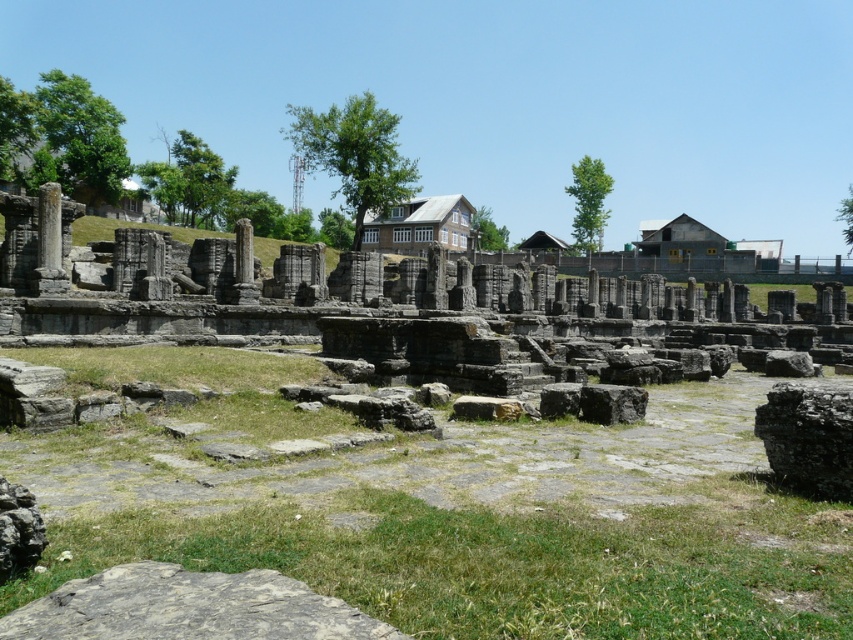
Does gray rough stone at lower right appear under rusty metallic rock at lower left?

No, gray rough stone at lower right is not below rusty metallic rock at lower left.

Can you confirm if gray rough stone at lower right is thinner than rusty metallic rock at lower left?

No, gray rough stone at lower right is not thinner than rusty metallic rock at lower left.

Between point (759, 410) and point (3, 579), which one is positioned in front?

Point (3, 579)

At what (x,y) coordinates should I click in order to perform the action: click on gray rough stone at lower right. Please return your answer as a coordinate pair (x, y). Looking at the image, I should click on (808, 436).

What do you see at coordinates (508, 563) in the screenshot? I see `green grass at lower center` at bounding box center [508, 563].

Which is in front, point (280, 528) or point (366, 621)?

Positioned in front is point (366, 621).

Locate an element on the screen. The width and height of the screenshot is (853, 640). green grass at lower center is located at coordinates (508, 563).

Identify the location of green grass at lower center. This screenshot has width=853, height=640. (508, 563).

Is green grass at lower center shorter than gray rough stone at center?

No, green grass at lower center is not shorter than gray rough stone at center.

Does green grass at lower center have a lesser width compared to gray rough stone at center?

Incorrect, green grass at lower center's width is not less than gray rough stone at center's.

You are a GUI agent. You are given a task and a screenshot of the screen. Output one action in this format:
    pyautogui.click(x=<x>, y=<y>)
    Task: Click on the green grass at lower center
    
    Given the screenshot: What is the action you would take?
    pyautogui.click(x=508, y=563)

Locate an element on the screen. green grass at lower center is located at coordinates (508, 563).